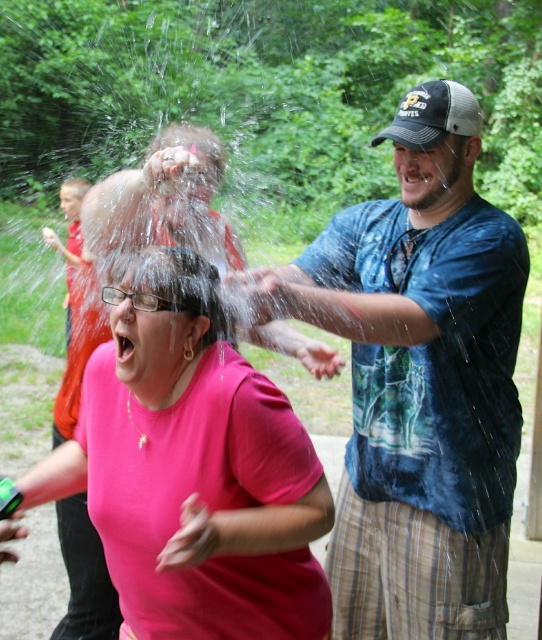
Question: Among these objects, which one is nearest to the camera?

Choices:
 (A) pink matte shirt at center
 (B) black mesh baseball cap at upper right

Answer: (A)

Question: Which object is closer to the camera taking this photo?

Choices:
 (A) pink matte shirt at center
 (B) blue tie-dye shirt at center
 (C) red shirt at left
 (D) black mesh baseball cap at upper right

Answer: (A)

Question: Is blue tie-dye shirt at center below black mesh baseball cap at upper right?

Choices:
 (A) yes
 (B) no

Answer: (A)

Question: Does pink matte shirt at center appear over red shirt at left?

Choices:
 (A) yes
 (B) no

Answer: (B)

Question: Which point is closer to the camera?

Choices:
 (A) click(x=397, y=396)
 (B) click(x=73, y=193)
 (C) click(x=151, y=285)

Answer: (C)

Question: From the image, what is the correct spatial relationship of pink matte shirt at center in relation to red shirt at left?

Choices:
 (A) below
 (B) above

Answer: (A)